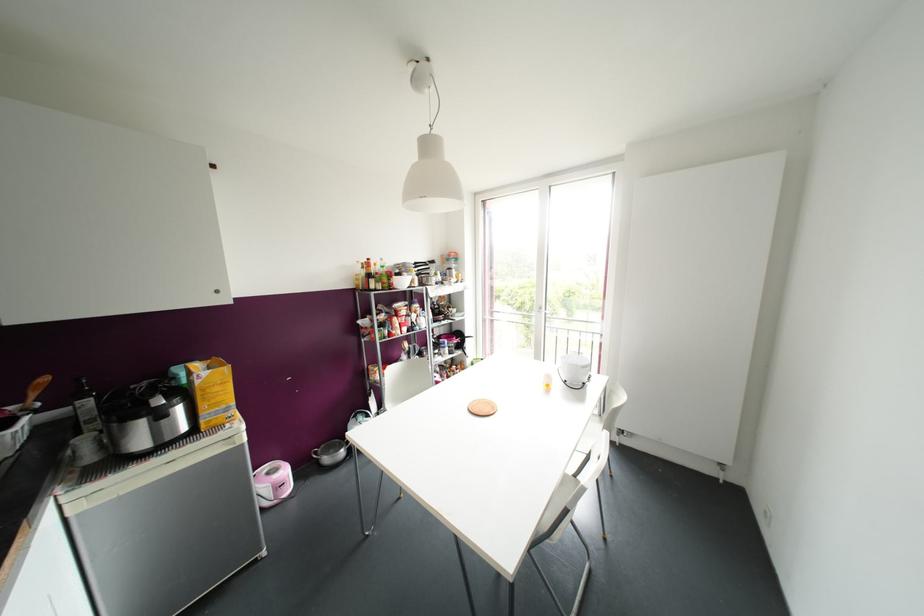
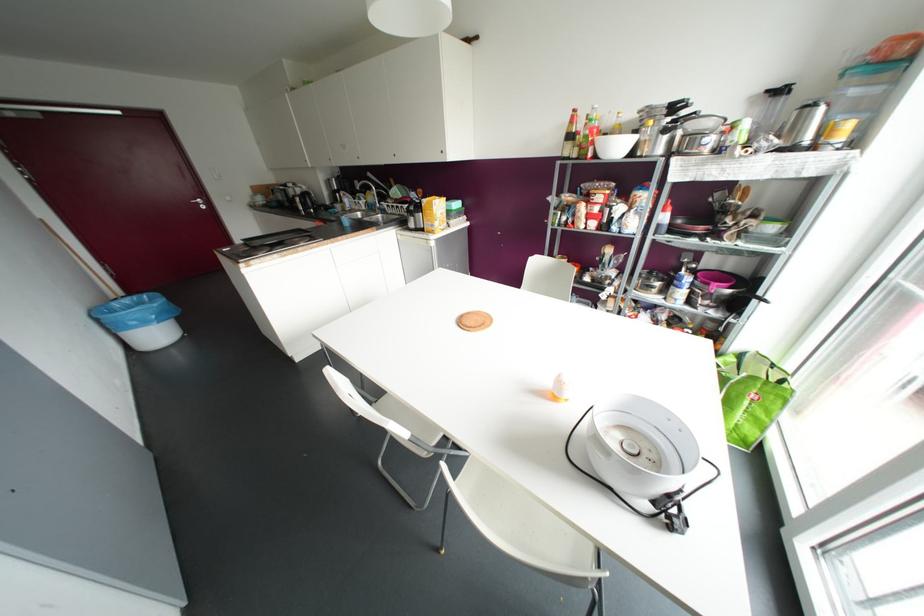
In the second image, find the point that corresponds to the point at 368,259 in the first image.

(574, 110)